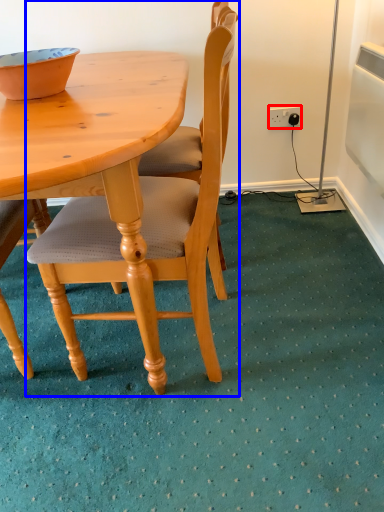
Question: Which object is further to the camera taking this photo, power outlet (highlighted by a red box) or chair (highlighted by a blue box)?

Choices:
 (A) power outlet
 (B) chair

Answer: (A)